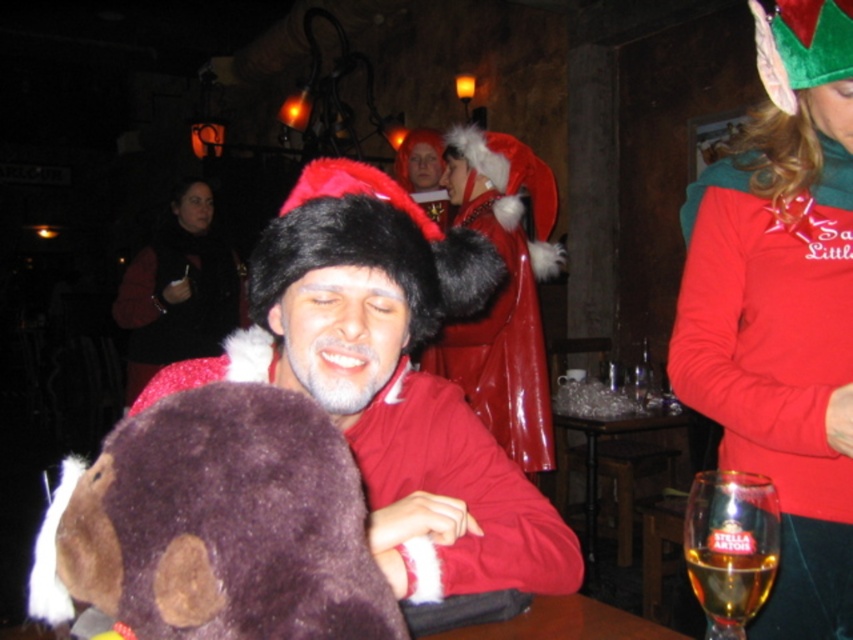
Question: Can you confirm if velvet green hat at upper right is smaller than velvet black vest at center?

Choices:
 (A) yes
 (B) no

Answer: (A)

Question: Estimate the real-world distances between objects in this image. Which object is closer to the velvet green hat at upper right?

Choices:
 (A) velvet black vest at center
 (B) fuzzy red coat at center

Answer: (B)

Question: Which object is closer to the camera taking this photo?

Choices:
 (A) golden glass at lower right
 (B) fuzzy red coat at center
 (C) brown plush bear at center
 (D) velvet green hat at upper right

Answer: (C)

Question: Can you confirm if fuzzy red coat at center is wider than shiny red coat at center?

Choices:
 (A) no
 (B) yes

Answer: (B)

Question: Which is farther from the brown plush bear at center?

Choices:
 (A) shiny red coat at center
 (B) velvet black vest at center

Answer: (B)

Question: From the image, what is the correct spatial relationship of shiny red coat at center in relation to velvet black vest at center?

Choices:
 (A) above
 (B) below

Answer: (B)